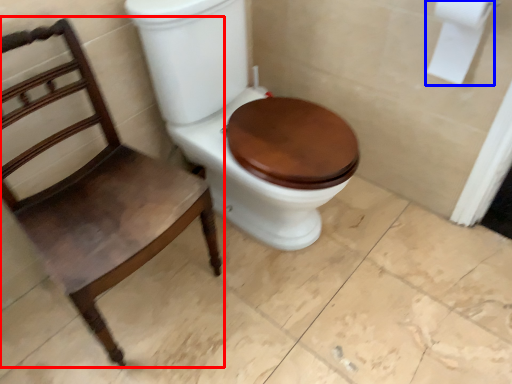
Question: Among these objects, which one is farthest to the camera, chair (highlighted by a red box) or toilet paper (highlighted by a blue box)?

Choices:
 (A) chair
 (B) toilet paper

Answer: (B)